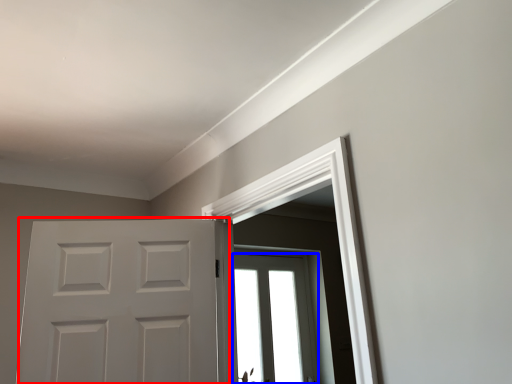
Question: Which point is closer to the camera, door (highlighted by a red box) or window (highlighted by a blue box)?

Choices:
 (A) door
 (B) window

Answer: (A)